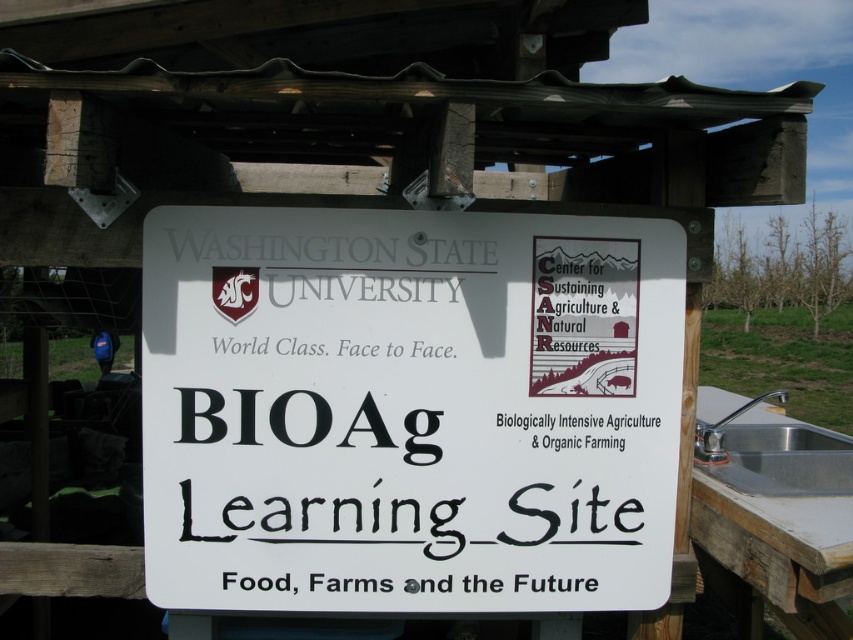
You are a visitor at the Washington State University BIOAg Learning Site. You see a white plastic sign at center and a silver metallic sink at right. Which object is wider?

The white plastic sign at center is wider than the silver metallic sink at right.

You are standing in a room and see a white plastic sign at center and a silver metallic sink at right. Which object takes up more space in the room?

The silver metallic sink at right takes up more space in the room than the white plastic sign at center because the white plastic sign at center occupies less space than silver metallic sink at right.

Based on the photo, you are standing in a lab and see a white plastic sign at center and a silver metallic sink at right. Which object is closer to your left side?

The white plastic sign at center is closer to your left side since it is positioned to the left of the silver metallic sink at right.